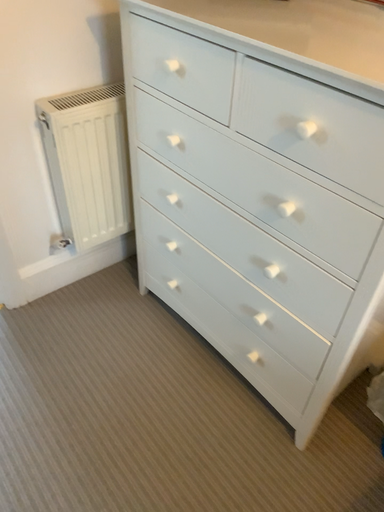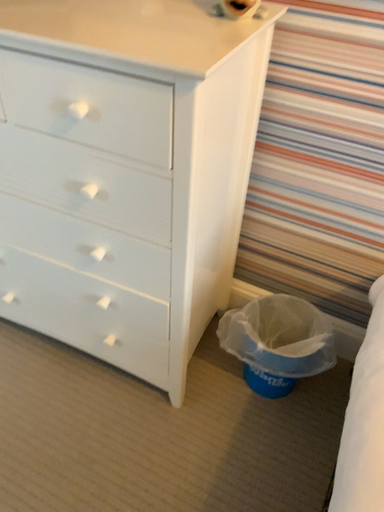
Question: Which way did the camera rotate in the video?

Choices:
 (A) rotated right
 (B) rotated left

Answer: (A)